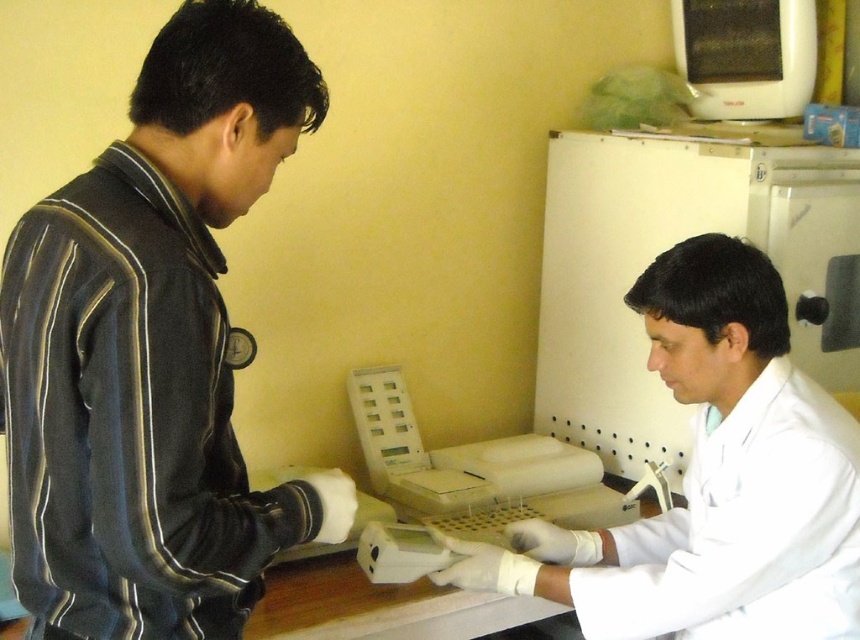
Question: Does dark blue fabric jacket at left have a greater width compared to black plastic microwave at upper right?

Choices:
 (A) yes
 (B) no

Answer: (A)

Question: Which object appears closest to the camera in this image?

Choices:
 (A) dark blue fabric jacket at left
 (B) white lab coat at center
 (C) black plastic microwave at upper right

Answer: (A)

Question: In this image, where is dark blue fabric jacket at left located relative to white lab coat at center?

Choices:
 (A) below
 (B) above

Answer: (B)

Question: Which point appears closest to the camera in this image?

Choices:
 (A) tap(118, 440)
 (B) tap(564, 554)
 (C) tap(760, 42)

Answer: (A)

Question: Which point is closer to the camera?

Choices:
 (A) (244, 564)
 (B) (723, 109)

Answer: (A)

Question: Can you confirm if dark blue fabric jacket at left is thinner than black plastic microwave at upper right?

Choices:
 (A) yes
 (B) no

Answer: (B)